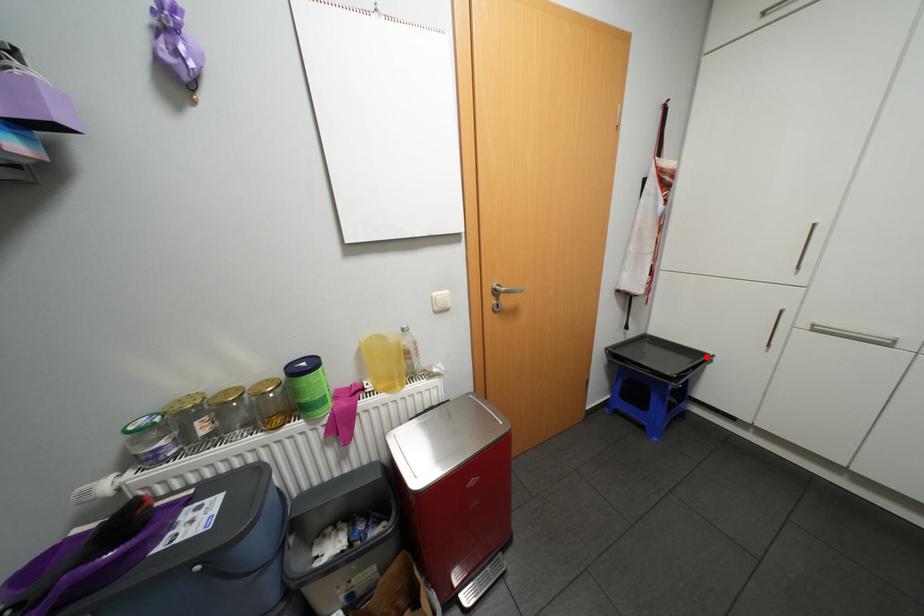
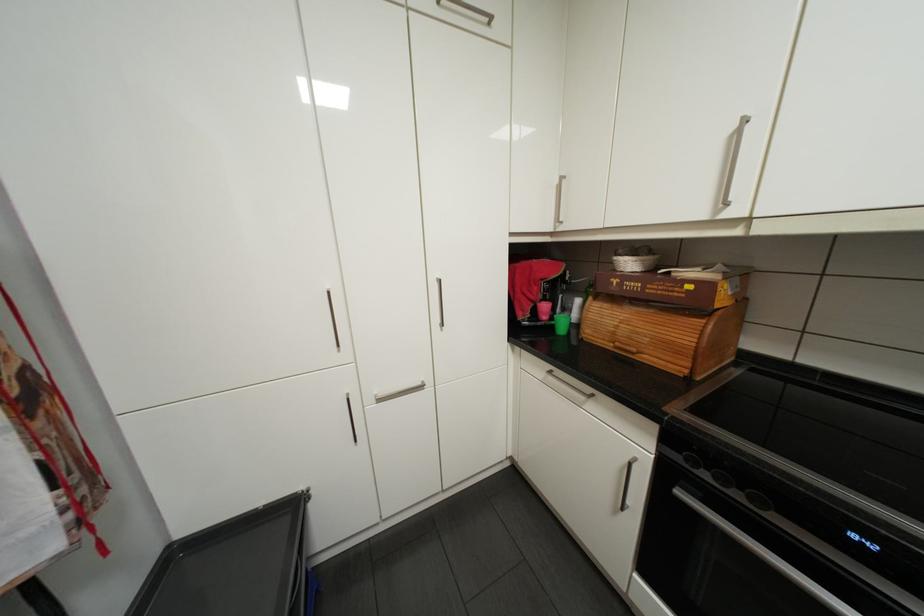
The point at the highlighted location is marked in the first image. Where is the corresponding point in the second image?

(300, 507)